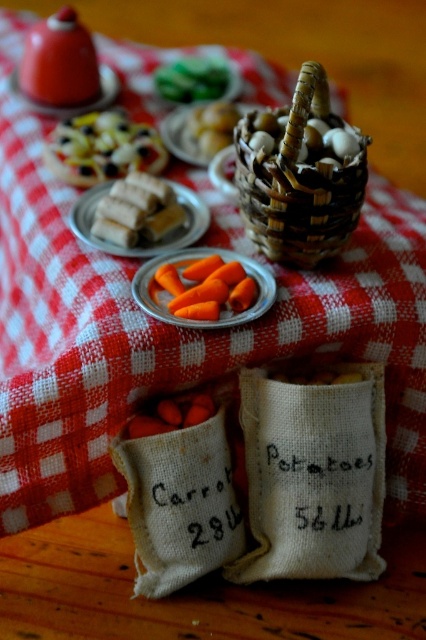
Question: Which point is farther to the camera?

Choices:
 (A) smooth white cheese at center
 (B) brown woven basket at center
 (C) shiny silver tray at upper left

Answer: (A)

Question: Based on their relative distances, which object is farther from the white matte sugar cube at center?

Choices:
 (A) shiny silver tray at upper left
 (B) green leafy vegetables at upper center
 (C) smooth white cheese at center

Answer: (B)

Question: Which object appears farthest from the camera in this image?

Choices:
 (A) orange matte carrot at center
 (B) green leafy vegetables at upper center
 (C) smooth brown basket at upper center
 (D) orange matte carrots at center

Answer: (B)

Question: Considering the relative positions of orange matte carrots at center and orange matte carrot at center in the image provided, where is orange matte carrots at center located with respect to orange matte carrot at center?

Choices:
 (A) left
 (B) right

Answer: (A)

Question: Is smooth white cheese at center positioned before orange matte carrot at center?

Choices:
 (A) yes
 (B) no

Answer: (B)

Question: Does brown woven basket at center come behind orange matte carrots at center?

Choices:
 (A) yes
 (B) no

Answer: (B)